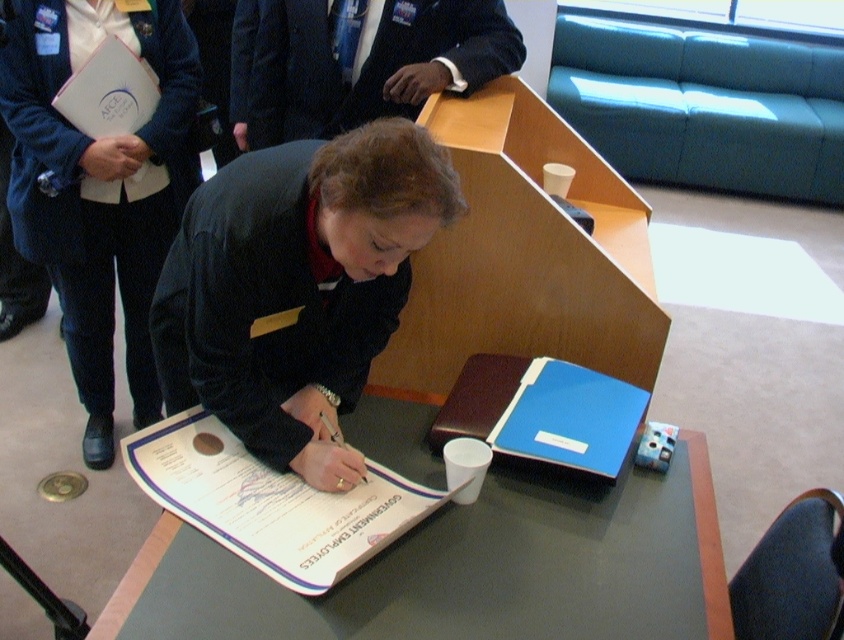
You are a photographer positioned in front of the scene. You need to capture a photo where both the smooth gray table at center and the dark blue suit at center are clearly visible. Which object should you focus on first to ensure both are in focus?

You should focus on the smooth gray table at center first because it is closer to the viewer than the dark blue suit at center, so adjusting focus starting from the closer object will help ensure both are in focus.

You are a professional photographer setting up for a formal event. You need to position a camera so that the dark blue suit at upper center and the blue plastic clipboard at center are both in focus. The camera has a depth of field that can cover objects within 35 inches of each other. Can you achieve this with their current positions?

The dark blue suit at upper center is 37.26 inches from the blue plastic clipboard at center. Since the camera can only cover 35 inches, the distance between them exceeds the depth of field range. Therefore, you cannot achieve both in focus with their current positions.